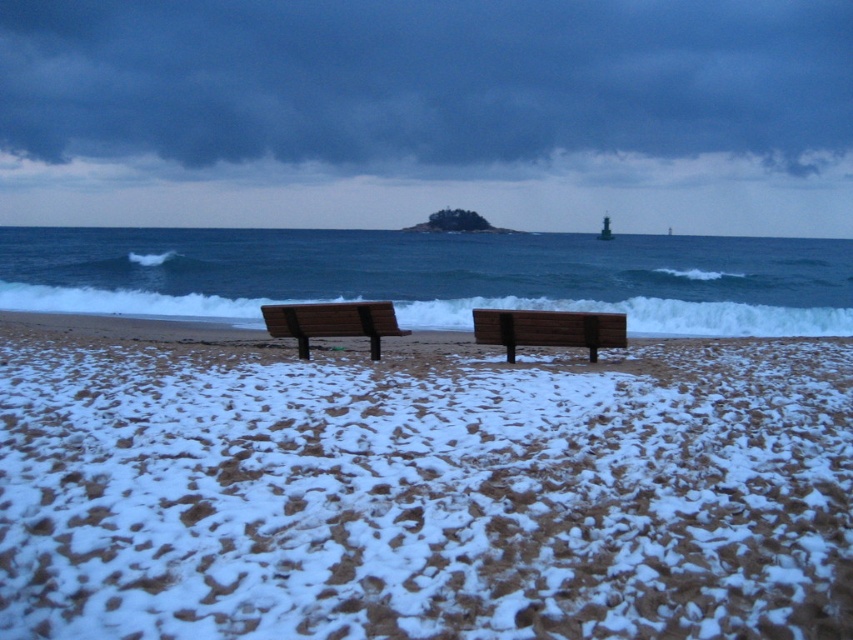
Question: Which is nearer to the white sandy beach at center?

Choices:
 (A) white foam wave at center
 (B) wooden bench at center
 (C) brown wooden bench at center

Answer: (C)

Question: Is white foam wave at center wider than wooden bench at center?

Choices:
 (A) no
 (B) yes

Answer: (B)

Question: Which object is farther from the camera taking this photo?

Choices:
 (A) brown wooden bench at center
 (B) white foam wave at center
 (C) wooden bench at center

Answer: (A)

Question: Is white foam wave at center to the left of wooden bench at center from the viewer's perspective?

Choices:
 (A) no
 (B) yes

Answer: (B)

Question: Is wooden bench at center positioned in front of brown wooden bench at center?

Choices:
 (A) yes
 (B) no

Answer: (A)

Question: Which object appears farthest from the camera in this image?

Choices:
 (A) brown wooden bench at center
 (B) white foam wave at center
 (C) white sandy beach at center
 (D) wooden bench at center

Answer: (A)